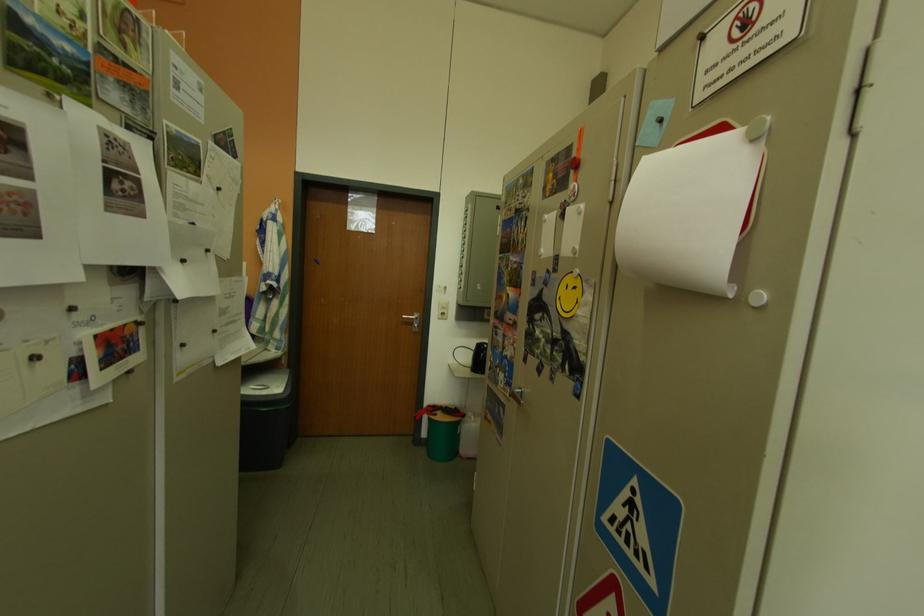
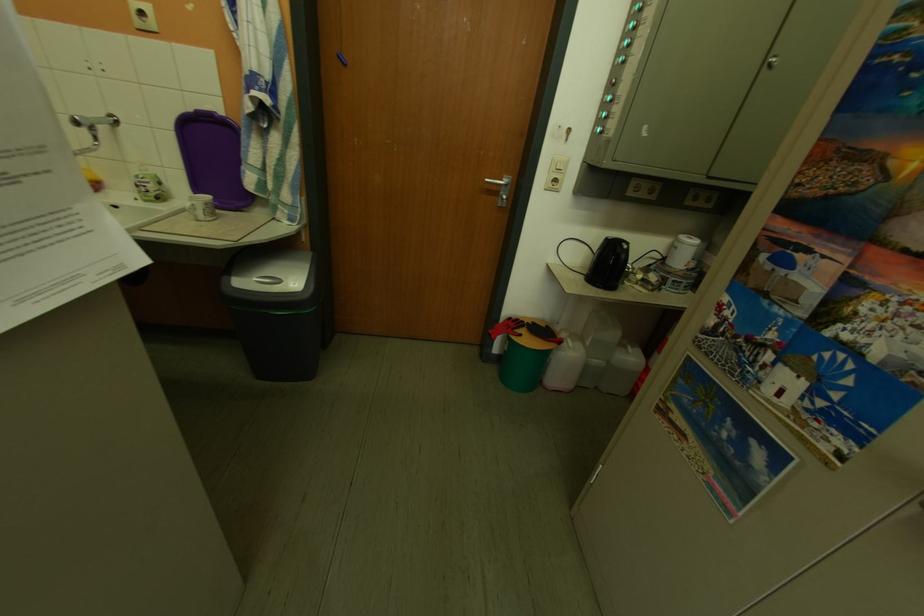
In the second image, find the point that corresponds to (x=476, y=418) in the first image.

(574, 345)